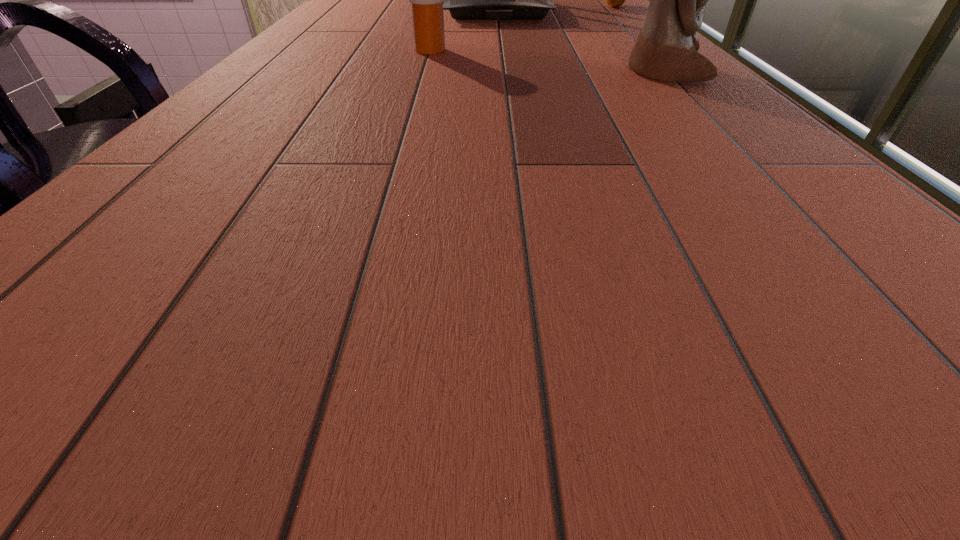
Image resolution: width=960 pixels, height=540 pixels. I want to click on medicine, so click(426, 0).

The height and width of the screenshot is (540, 960). I want to click on the second shortest object, so click(x=426, y=0).

Locate an element on the screen. This screenshot has width=960, height=540. the nearest object is located at coordinates (666, 49).

Locate an element on the screen. figurine is located at coordinates (666, 49).

Locate an element on the screen. The height and width of the screenshot is (540, 960). the shortest object is located at coordinates (614, 0).

Identify the location of router. The image size is (960, 540). (466, 0).

In order to click on vacant space located 0.080m on the front of the third tallest object in this screenshot , I will do `click(425, 66)`.

Where is `vacant space located with leaves positioned above the shortest object`? This screenshot has width=960, height=540. vacant space located with leaves positioned above the shortest object is located at coordinates (589, 34).

You are a GUI agent. You are given a task and a screenshot of the screen. Output one action in this format:
    pyautogui.click(x=<x>, y=<y>)
    Task: Click on the vacant space located 0.170m with leaves positioned above the shortest object
    This screenshot has height=540, width=960.
    Given the screenshot: What is the action you would take?
    pyautogui.click(x=599, y=23)

The width and height of the screenshot is (960, 540). Identify the location of blank space located 0.380m with leaves positioned above the shortest object. (581, 43).